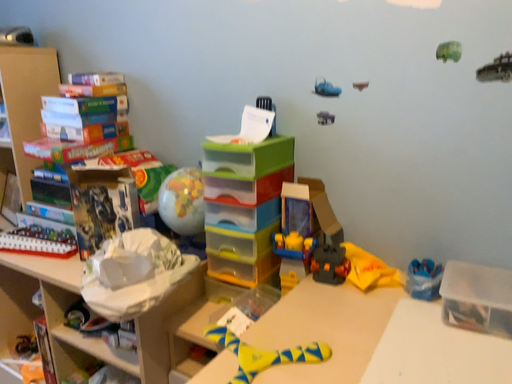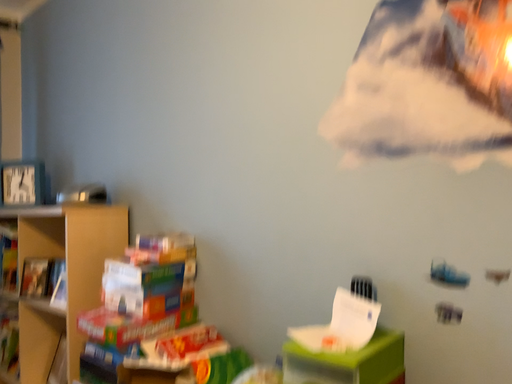
Question: How did the camera likely rotate when shooting the video?

Choices:
 (A) rotated downward
 (B) rotated upward

Answer: (B)